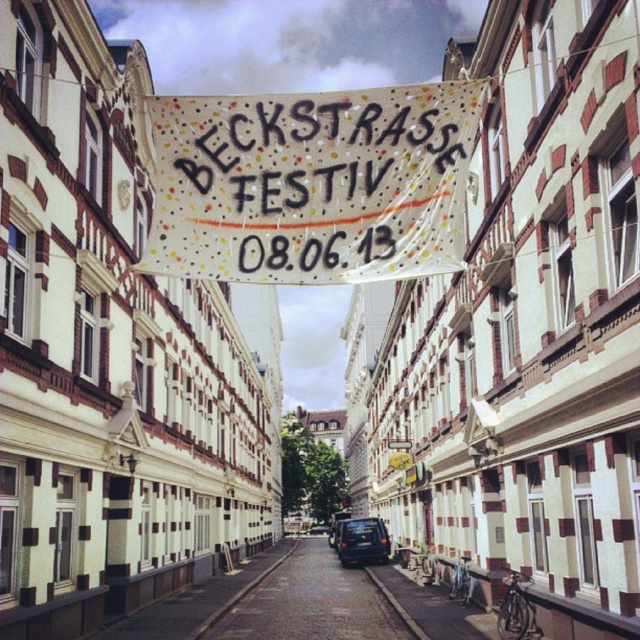
Question: Does white fabric banner at center have a smaller size compared to dark blue matte van at center?

Choices:
 (A) no
 (B) yes

Answer: (A)

Question: Is the position of dark gray asphalt at center more distant than that of dark blue matte van at center?

Choices:
 (A) yes
 (B) no

Answer: (B)

Question: Estimate the real-world distances between objects in this image. Which object is farther from the white fabric banner at center?

Choices:
 (A) dark blue matte van at center
 (B) dark gray asphalt at center

Answer: (A)

Question: Does white fabric banner at center have a greater width compared to dark gray asphalt at center?

Choices:
 (A) yes
 (B) no

Answer: (A)

Question: Which point is closer to the camera?

Choices:
 (A) (339, 545)
 (B) (301, 632)
 (C) (273, 182)

Answer: (C)

Question: Estimate the real-world distances between objects in this image. Which object is farther from the dark blue matte van at center?

Choices:
 (A) dark gray asphalt at center
 (B) white fabric banner at center

Answer: (B)